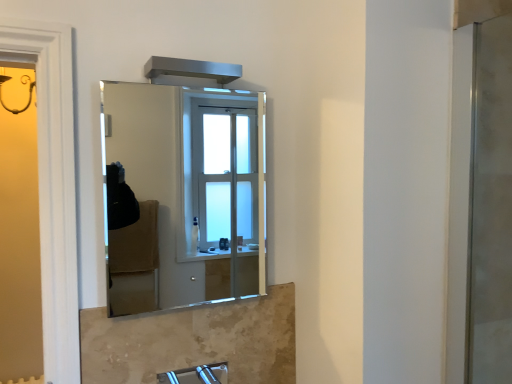
Question: Considering the relative positions of satin nickel faucet at lower center and clear glass mirror at center in the image provided, is satin nickel faucet at lower center to the right of clear glass mirror at center from the viewer's perspective?

Choices:
 (A) yes
 (B) no

Answer: (A)

Question: Is satin nickel faucet at lower center facing away from clear glass mirror at center?

Choices:
 (A) no
 (B) yes

Answer: (A)

Question: Can you confirm if satin nickel faucet at lower center is wider than clear glass mirror at center?

Choices:
 (A) yes
 (B) no

Answer: (A)

Question: Is satin nickel faucet at lower center aimed at clear glass mirror at center?

Choices:
 (A) yes
 (B) no

Answer: (B)

Question: Is satin nickel faucet at lower center next to clear glass mirror at center and touching it?

Choices:
 (A) no
 (B) yes

Answer: (A)

Question: From a real-world perspective, relative to clear glass mirror at center, is satin nickel faucet at lower center vertically above or below?

Choices:
 (A) above
 (B) below

Answer: (B)

Question: Based on their sizes in the image, would you say satin nickel faucet at lower center is bigger or smaller than clear glass mirror at center?

Choices:
 (A) small
 (B) big

Answer: (A)

Question: Considering the relative positions of satin nickel faucet at lower center and clear glass mirror at center in the image provided, is satin nickel faucet at lower center to the left or to the right of clear glass mirror at center?

Choices:
 (A) right
 (B) left

Answer: (A)

Question: From the image's perspective, is satin nickel faucet at lower center located above or below clear glass mirror at center?

Choices:
 (A) below
 (B) above

Answer: (A)

Question: Is point (230, 122) positioned closer to the camera than point (172, 375)?

Choices:
 (A) closer
 (B) farther

Answer: (B)

Question: Considering their positions, is clear glass mirror at center located in front of or behind satin nickel faucet at lower center?

Choices:
 (A) front
 (B) behind

Answer: (B)

Question: From a real-world perspective, is clear glass mirror at center positioned above or below satin nickel faucet at lower center?

Choices:
 (A) above
 (B) below

Answer: (A)

Question: Is clear glass mirror at center inside or outside of satin nickel faucet at lower center?

Choices:
 (A) inside
 (B) outside

Answer: (B)

Question: Considering the positions of point (208, 160) and point (485, 314), is point (208, 160) closer or farther from the camera than point (485, 314)?

Choices:
 (A) farther
 (B) closer

Answer: (A)

Question: Considering the positions of clear glass mirror at center and clear glass screen door at right in the image, is clear glass mirror at center bigger or smaller than clear glass screen door at right?

Choices:
 (A) small
 (B) big

Answer: (A)